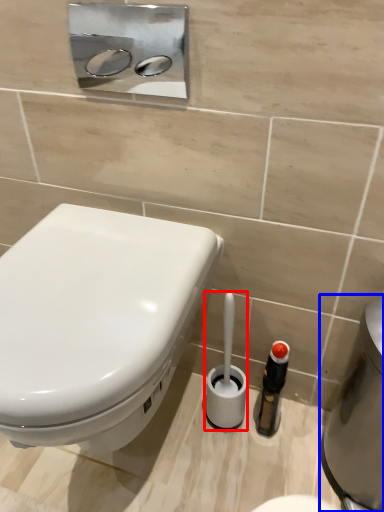
Question: Which of the following is the closest to the observer, brush (highlighted by a red box) or water heater (highlighted by a blue box)?

Choices:
 (A) brush
 (B) water heater

Answer: (B)